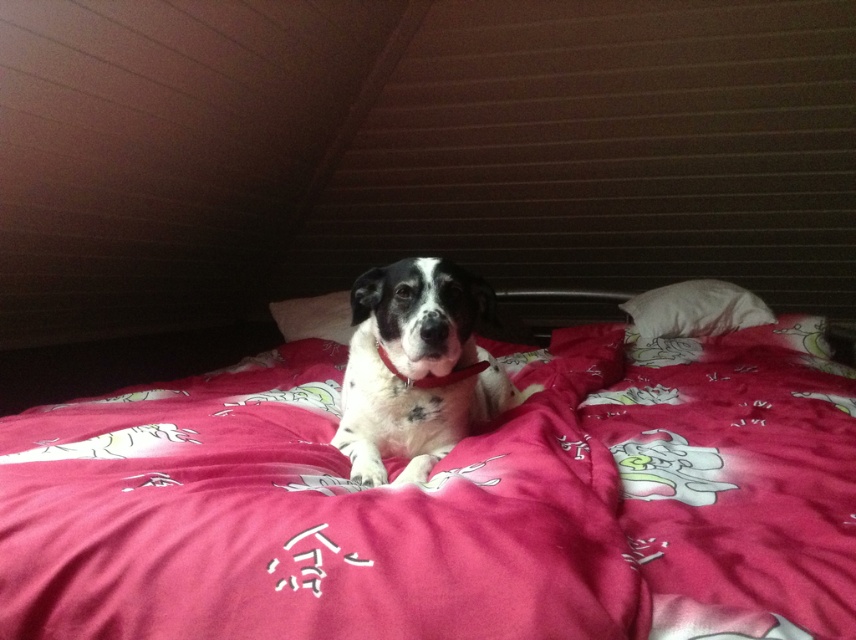
Which is above, white-spotted fur dog at center or white soft pillow at center?

Positioned higher is white soft pillow at center.

Can you confirm if white-spotted fur dog at center is positioned above white soft pillow at center?

No, white-spotted fur dog at center is not above white soft pillow at center.

Which is behind, point (355, 312) or point (286, 305)?

The point (286, 305) is behind.

Find the location of a particular element. white-spotted fur dog at center is located at coordinates tap(415, 369).

Which is more to the right, pink fabric bed at center or white soft pillow at upper center?

white soft pillow at upper center

Where is `pink fabric bed at center`? pink fabric bed at center is located at coordinates (449, 502).

Is white-spotted fur dog at center thinner than white soft pillow at upper center?

Yes, white-spotted fur dog at center is thinner than white soft pillow at upper center.

Does white-spotted fur dog at center have a greater height compared to white soft pillow at upper center?

Yes, white-spotted fur dog at center is taller than white soft pillow at upper center.

Between point (434, 458) and point (727, 298), which one is positioned in front?

Positioned in front is point (434, 458).

This screenshot has height=640, width=856. I want to click on white-spotted fur dog at center, so click(x=415, y=369).